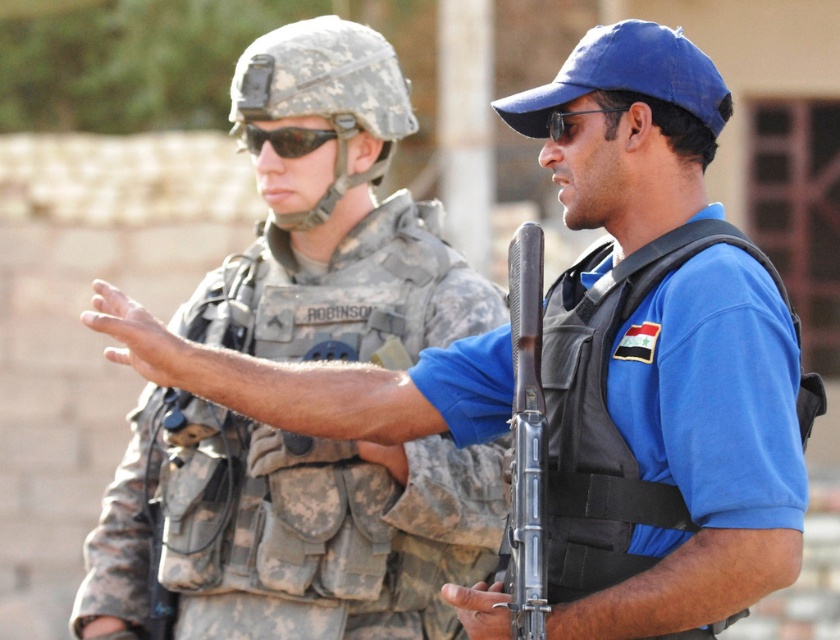
Question: Which object is closer to the camera taking this photo?

Choices:
 (A) black matte sunglasses at center
 (B) camouflage fabric uniform at center

Answer: (B)

Question: Can you confirm if camouflage fabric uniform at center is positioned above black matte sunglasses at center?

Choices:
 (A) yes
 (B) no

Answer: (B)

Question: Which object is positioned farthest from the black matte sunglasses at center?

Choices:
 (A) silver metallic rifle at center
 (B) camouflage fabric uniform at center

Answer: (A)

Question: Can you confirm if camouflage fabric uniform at center is positioned to the right of black matte sunglasses at center?

Choices:
 (A) no
 (B) yes

Answer: (B)

Question: Which of the following is the closest to the observer?

Choices:
 (A) silver metallic rifle at center
 (B) black matte sunglasses at center
 (C) camouflage fabric uniform at center

Answer: (A)

Question: Can you confirm if silver metallic rifle at center is bigger than black matte sunglasses at center?

Choices:
 (A) no
 (B) yes

Answer: (B)